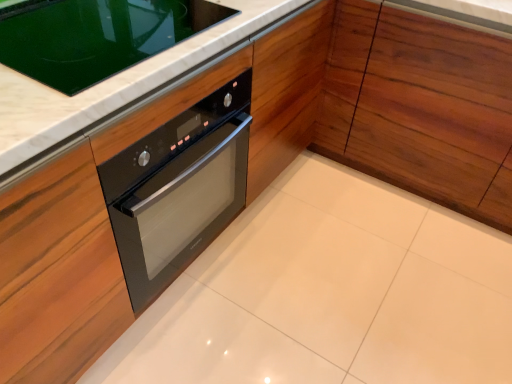
Question: Relative to black glass oven at upper left, is wooden cabinet at center in front or behind?

Choices:
 (A) behind
 (B) front

Answer: (A)

Question: In terms of width, does wooden cabinet at center look wider or thinner when compared to black glass oven at upper left?

Choices:
 (A) wide
 (B) thin

Answer: (A)

Question: Is point (380, 114) closer or farther from the camera than point (188, 26)?

Choices:
 (A) farther
 (B) closer

Answer: (A)

Question: Is black glass oven at upper left bigger or smaller than wooden cabinet at center?

Choices:
 (A) small
 (B) big

Answer: (A)

Question: Relative to wooden cabinet at center, is black glass oven at upper left in front or behind?

Choices:
 (A) behind
 (B) front

Answer: (B)

Question: From a real-world perspective, is black glass oven at upper left above or below wooden cabinet at center?

Choices:
 (A) above
 (B) below

Answer: (A)

Question: Does point (181, 36) appear closer or farther from the camera than point (504, 130)?

Choices:
 (A) closer
 (B) farther

Answer: (A)